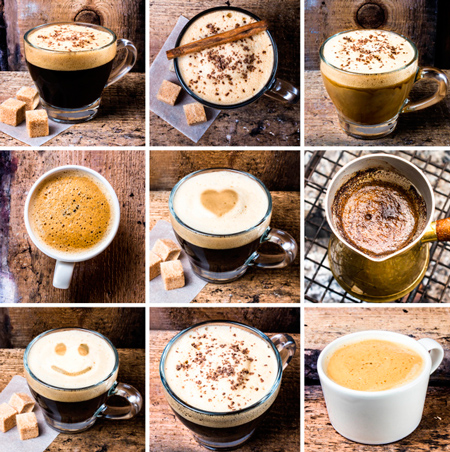
You are a GUI agent. You are given a task and a screenshot of the screen. Output one action in this format:
    pyautogui.click(x=<x>, y=<y>)
    Task: Click on the rim of coffee mug
    This screenshot has height=452, width=450.
    Given the screenshot: What is the action you would take?
    pyautogui.click(x=78, y=328), pyautogui.click(x=185, y=330), pyautogui.click(x=343, y=337), pyautogui.click(x=225, y=168), pyautogui.click(x=85, y=167), pyautogui.click(x=49, y=24), pyautogui.click(x=189, y=22), pyautogui.click(x=321, y=53)